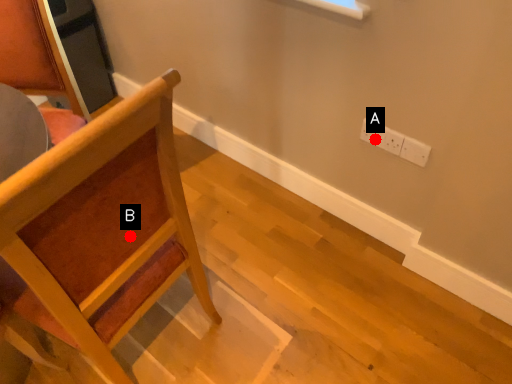
Question: Two points are circled on the image, labeled by A and B beside each circle. Which point is farther to the camera?

Choices:
 (A) A is further
 (B) B is further

Answer: (A)